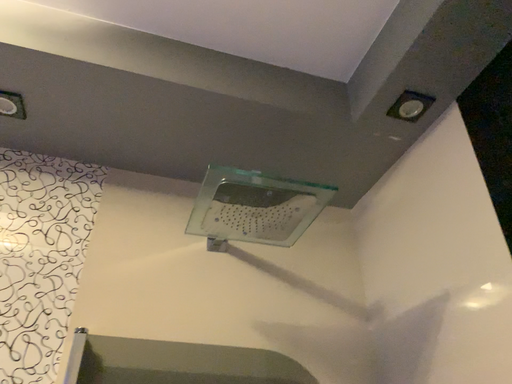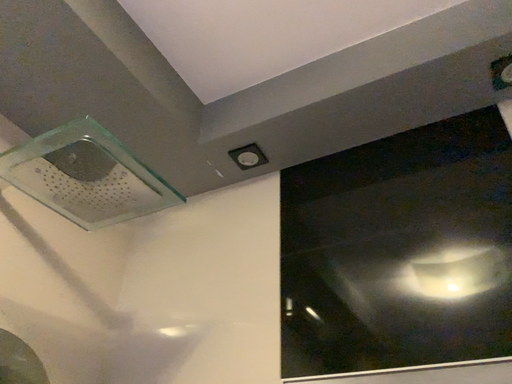
Question: How did the camera likely rotate when shooting the video?

Choices:
 (A) rotated left
 (B) rotated right

Answer: (B)